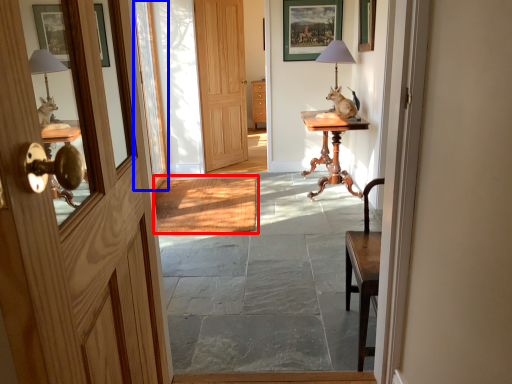
Question: Among these objects, which one is nearest to the camera, doormat (highlighted by a red box) or glass door (highlighted by a blue box)?

Choices:
 (A) doormat
 (B) glass door

Answer: (A)